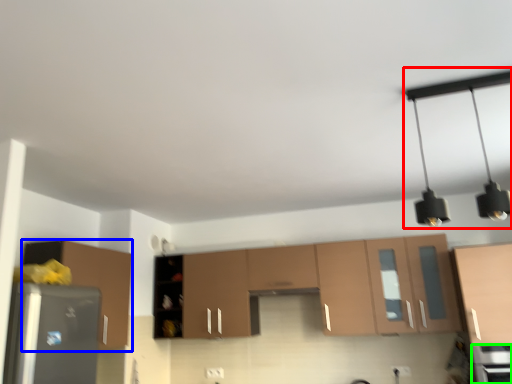
Question: Which object is the closest to the light fixture (highlighted by a red box)? Choose among these: cabinetry (highlighted by a blue box) or appliance (highlighted by a green box).

Choices:
 (A) cabinetry
 (B) appliance

Answer: (B)